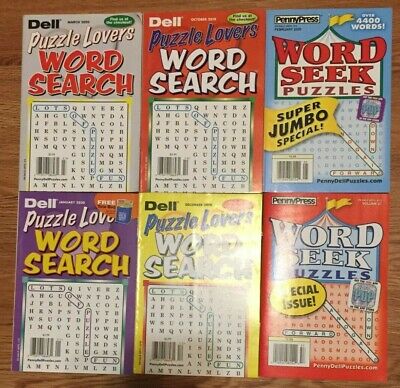
The image size is (400, 388). In order to click on purple book in this screenshot , I will do `click(126, 240)`.